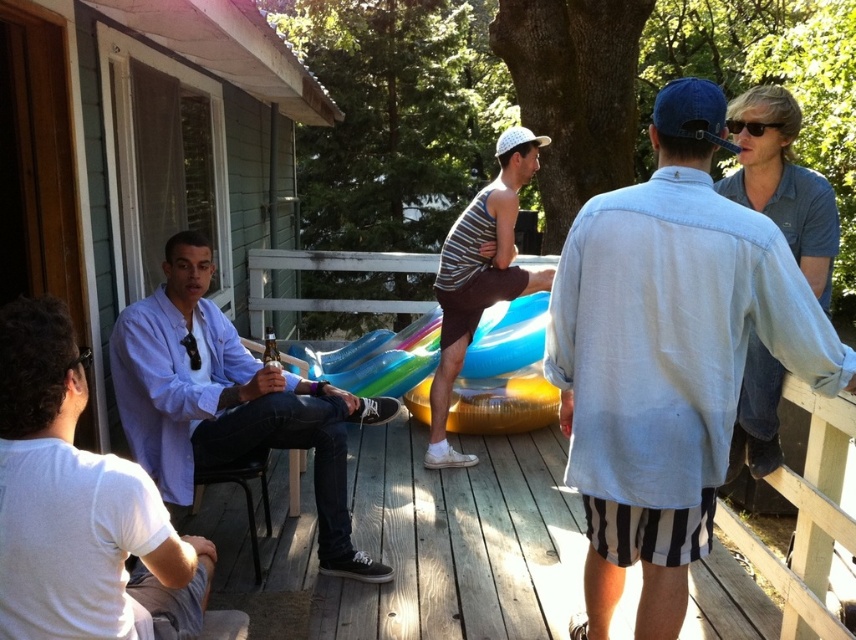
Question: Is light purple shirt at left to the right of blue denim shirt at upper right from the viewer's perspective?

Choices:
 (A) yes
 (B) no

Answer: (B)

Question: Does white cotton shirt at left appear under blue denim shirt at upper right?

Choices:
 (A) no
 (B) yes

Answer: (B)

Question: Among these points, which one is farthest from the camera?

Choices:
 (A) tap(682, 163)
 (B) tap(206, 442)
 (C) tap(34, 401)

Answer: (B)

Question: From the image, what is the correct spatial relationship of blue denim shirt at upper right in relation to striped tank top at center?

Choices:
 (A) above
 (B) below

Answer: (A)

Question: Which of the following is the farthest from the observer?

Choices:
 (A) denim shirt at upper right
 (B) light purple shirt at left
 (C) striped tank top at center
 (D) white cotton shirt at left

Answer: (C)

Question: Which point is farther from the camera taking this photo?

Choices:
 (A) [x=531, y=138]
 (B) [x=681, y=388]
 (C) [x=277, y=401]

Answer: (A)